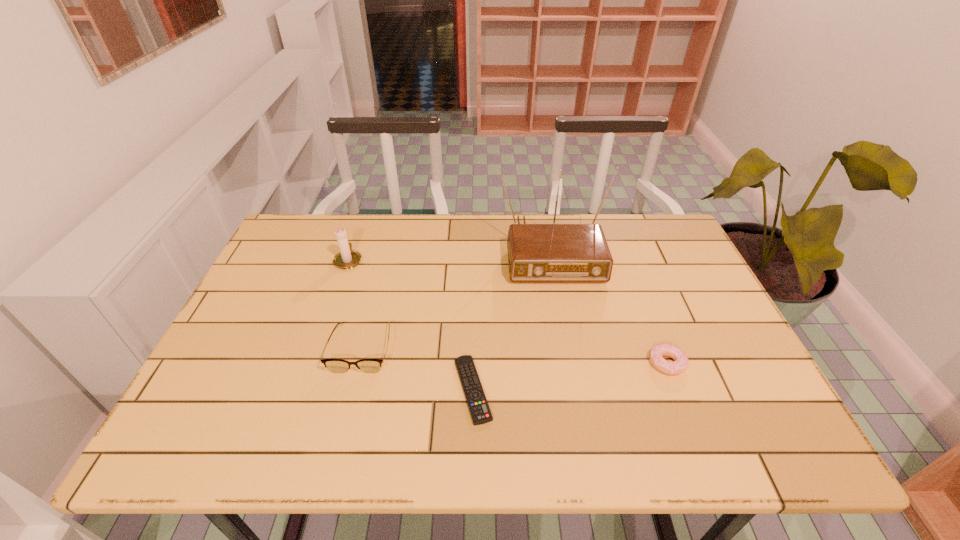
At what (x,y) coordinates should I click in order to perform the action: click on empty space that is in between the rightmost object and the third tallest object. Please return your answer as a coordinate pair (x, y). Looking at the image, I should click on (515, 356).

At what (x,y) coordinates should I click in order to perform the action: click on vacant point located between the spectacles and the fourth shortest object. Please return your answer as a coordinate pair (x, y). The height and width of the screenshot is (540, 960). Looking at the image, I should click on click(x=355, y=304).

Image resolution: width=960 pixels, height=540 pixels. I want to click on blank region between the tallest object and the second tallest object, so click(449, 254).

This screenshot has height=540, width=960. Identify the location of free space between the fourth tallest object and the spectacles. (x=515, y=356).

Locate an element on the screen. unoccupied position between the third object from left to right and the candle holder is located at coordinates (411, 325).

Identify the location of object that is the second closest to the remote control. The image size is (960, 540). tap(537, 253).

What are the coordinates of `object that ranks as the closest to the doughnut` in the screenshot? It's located at pyautogui.click(x=537, y=253).

Image resolution: width=960 pixels, height=540 pixels. Find the location of `free location that satisfies the following two spatial constraints: 1. on the back side of the shortest object; 2. on the left side of the doughnut`. free location that satisfies the following two spatial constraints: 1. on the back side of the shortest object; 2. on the left side of the doughnut is located at coordinates (473, 363).

The width and height of the screenshot is (960, 540). Identify the location of free space that satisfies the following two spatial constraints: 1. on the face of the shortest object; 2. on the left side of the third shortest object. (351, 389).

Locate an element on the screen. The height and width of the screenshot is (540, 960). free space that satisfies the following two spatial constraints: 1. on the front panel of the second shortest object; 2. on the left side of the tallest object is located at coordinates (571, 363).